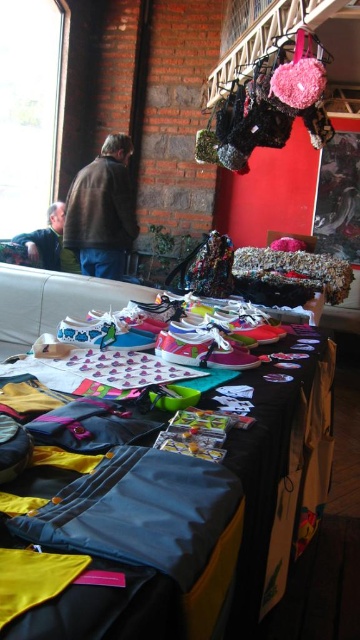
Does point (195, 472) lie in front of point (129, 192)?

Yes, point (195, 472) is in front of point (129, 192).

Find the location of a particular element. This screenshot has width=360, height=640. shiny fabric bags at center is located at coordinates (171, 520).

Between brown leather jacket at center and gray fabric jacket at left, which one has less height?

Standing shorter between the two is gray fabric jacket at left.

This screenshot has width=360, height=640. Describe the element at coordinates (101, 211) in the screenshot. I see `brown leather jacket at center` at that location.

Is point (117, 193) positioned in front of point (46, 227)?

Yes, it is.

Where is `brown leather jacket at center`? Image resolution: width=360 pixels, height=640 pixels. brown leather jacket at center is located at coordinates (101, 211).

Is shiny fabric bags at center further to camera compared to gray fabric jacket at left?

No, shiny fabric bags at center is in front of gray fabric jacket at left.

Is shiny fabric bags at center smaller than gray fabric jacket at left?

Incorrect, shiny fabric bags at center is not smaller in size than gray fabric jacket at left.

What do you see at coordinates (171, 520) in the screenshot? I see `shiny fabric bags at center` at bounding box center [171, 520].

This screenshot has height=640, width=360. I want to click on shiny fabric bags at center, so click(x=171, y=520).